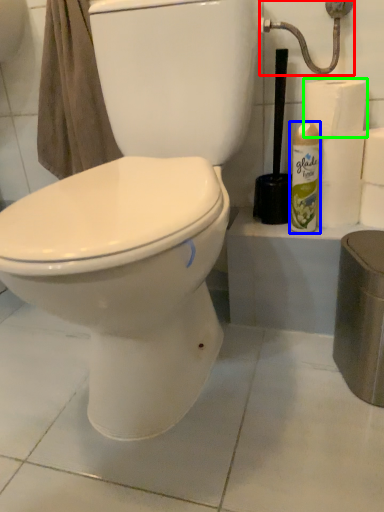
Question: Which object is positioned closest to shower (highlighted by a red box)? Select from cleaning product (highlighted by a blue box) and toilet paper (highlighted by a green box).

Choices:
 (A) cleaning product
 (B) toilet paper

Answer: (B)